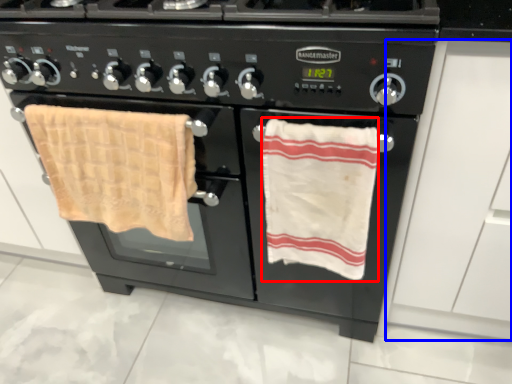
Question: Which of the following is the farthest to the observer, beach towel (highlighted by a red box) or drawer (highlighted by a blue box)?

Choices:
 (A) beach towel
 (B) drawer

Answer: (A)